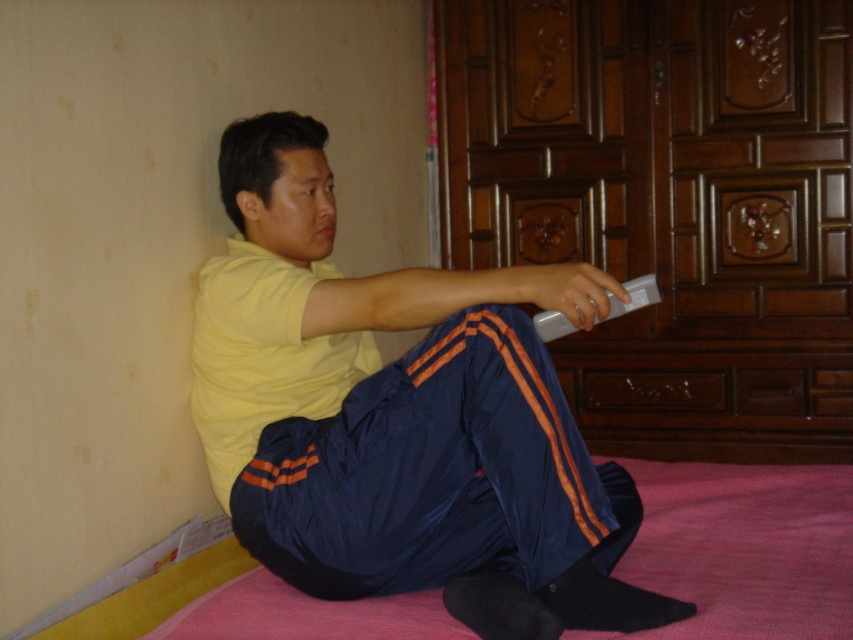
Is yellow matte shirt at center positioned in front of silver metallic remote at center?

Yes, it is in front of silver metallic remote at center.

Can you confirm if yellow matte shirt at center is taller than silver metallic remote at center?

Indeed, yellow matte shirt at center has a greater height compared to silver metallic remote at center.

Find the location of `yellow matte shirt at center`. yellow matte shirt at center is located at coordinates (399, 417).